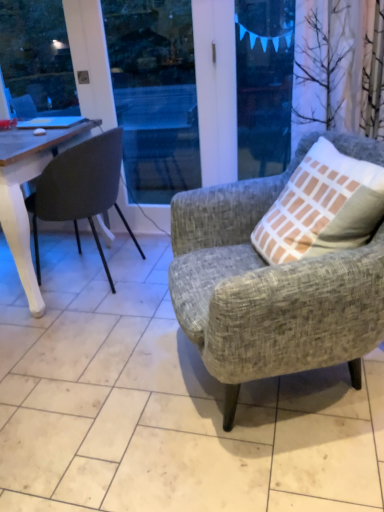
The image size is (384, 512). Identify the location of free space on the front side of matte black chair at left, which ranks as the 1th chair in left-to-right order. (60, 321).